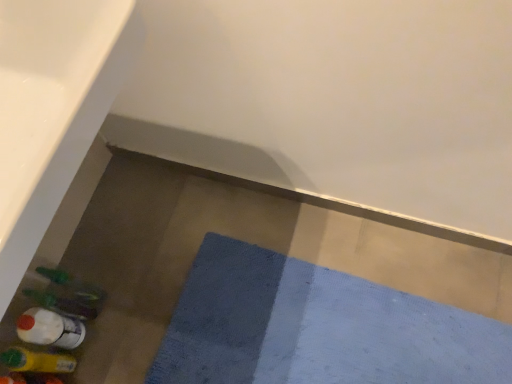
I want to click on vacant area that is in front of translucent plastic bottle at lower left, which is the second bottle from top to bottom, so click(x=96, y=365).